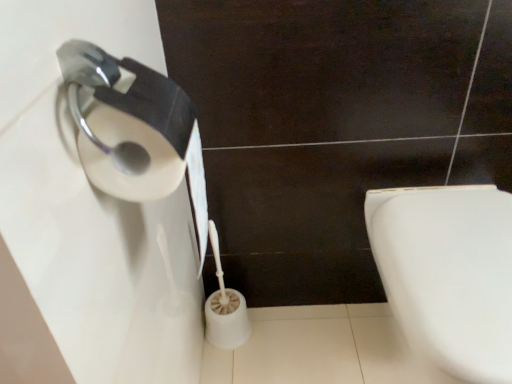
Image resolution: width=512 pixels, height=384 pixels. Identify the location of free space above white glossy toilet at lower right (from a real-world perspective). (460, 239).